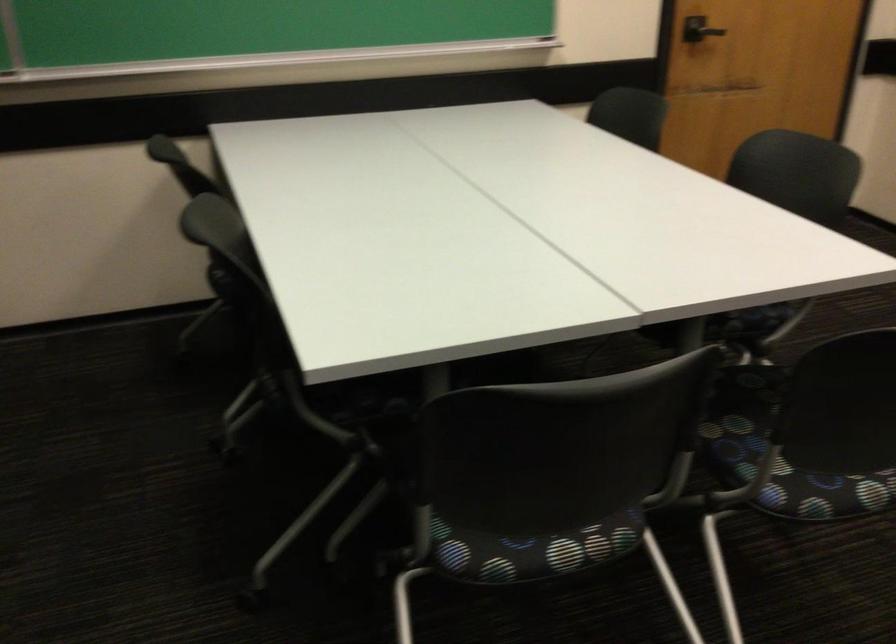
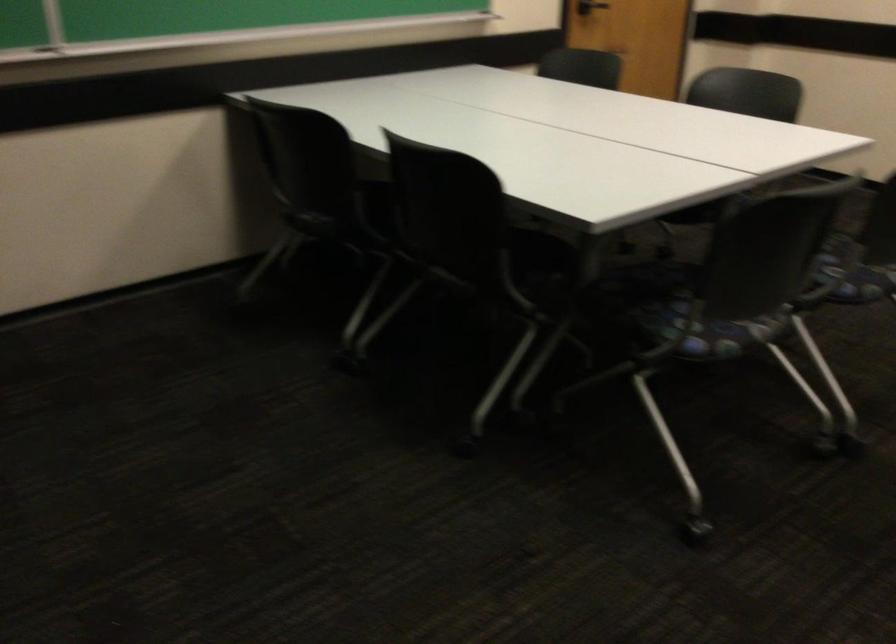
Locate, in the second image, the point that corresponds to (x=271, y=343) in the first image.

(455, 245)